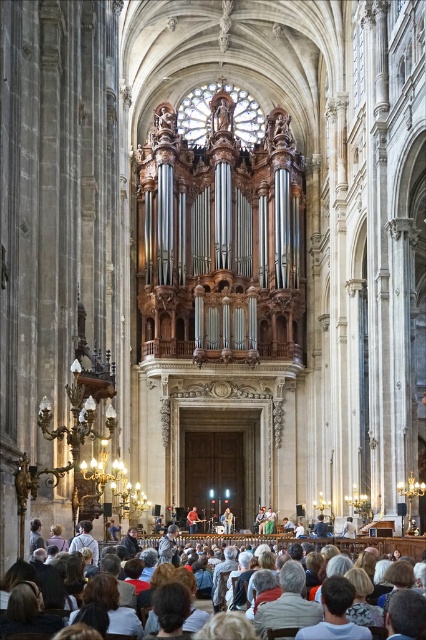
Is light brown wooden chairs at lower center thinner than red shirt at lower center?

No, light brown wooden chairs at lower center is not thinner than red shirt at lower center.

Based on the photo, can you confirm if light brown wooden chairs at lower center is wider than red shirt at lower center?

Yes.

Is point (262, 538) in front of point (198, 520)?

Yes, point (262, 538) is in front of point (198, 520).

Find the location of `light brown wooden chairs at lower center`. light brown wooden chairs at lower center is located at coordinates (377, 545).